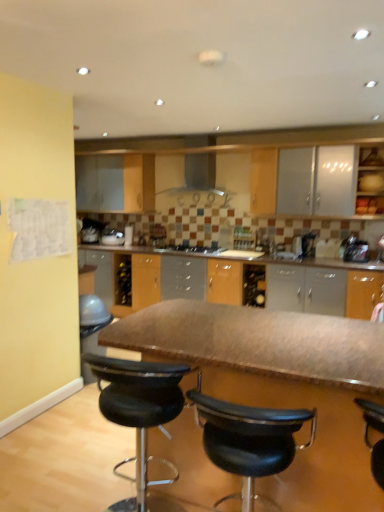
Question: Can you confirm if black leather stool at center, which is the first chair in left-to-right order, is bigger than smooth brown table at center?

Choices:
 (A) no
 (B) yes

Answer: (A)

Question: Is black leather stool at center, positioned as the second chair in right-to-left order, with smooth brown table at center?

Choices:
 (A) yes
 (B) no

Answer: (B)

Question: Is black leather stool at center, positioned as the second chair in right-to-left order, not inside smooth brown table at center?

Choices:
 (A) no
 (B) yes

Answer: (A)

Question: Is black leather stool at center, which is the first chair in left-to-right order, positioned in front of smooth brown table at center?

Choices:
 (A) yes
 (B) no

Answer: (B)

Question: Can you confirm if black leather stool at center, positioned as the second chair in right-to-left order, is positioned to the left of smooth brown table at center?

Choices:
 (A) no
 (B) yes

Answer: (B)

Question: In the image, is satin black kettle at right, the second appliance in the left-to-right sequence, on the left side or the right side of smooth brown table at center?

Choices:
 (A) right
 (B) left

Answer: (A)

Question: Considering their positions, is satin black kettle at right, placed as the first appliance when sorted from right to left, located in front of or behind smooth brown table at center?

Choices:
 (A) front
 (B) behind

Answer: (B)

Question: Based on their sizes in the image, would you say satin black kettle at right, placed as the first appliance when sorted from right to left, is bigger or smaller than smooth brown table at center?

Choices:
 (A) small
 (B) big

Answer: (A)

Question: From a real-world perspective, is satin black kettle at right, placed as the first appliance when sorted from right to left, physically located above or below smooth brown table at center?

Choices:
 (A) above
 (B) below

Answer: (A)

Question: In terms of size, does matte wood cabinet at upper right appear bigger or smaller than black leather stool at center, which appears as the first chair when viewed from the right?

Choices:
 (A) big
 (B) small

Answer: (B)

Question: Is point (382, 186) closer or farther from the camera than point (231, 441)?

Choices:
 (A) farther
 (B) closer

Answer: (A)

Question: Considering the positions of matte wood cabinet at upper right and black leather stool at center, which appears as the first chair when viewed from the right, in the image, is matte wood cabinet at upper right wider or thinner than black leather stool at center, which appears as the first chair when viewed from the right,?

Choices:
 (A) wide
 (B) thin

Answer: (B)

Question: From the image's perspective, is matte wood cabinet at upper right above or below black leather stool at center, the 2th chair in the left-to-right sequence?

Choices:
 (A) above
 (B) below

Answer: (A)

Question: Is black leather stool at center, which is the first chair in left-to-right order, bigger or smaller than satin black kettle at right, which is the second appliance from back to front?

Choices:
 (A) big
 (B) small

Answer: (A)

Question: Relative to satin black kettle at right, which is the second appliance from back to front, is black leather stool at center, positioned as the second chair in right-to-left order, in front or behind?

Choices:
 (A) behind
 (B) front

Answer: (B)